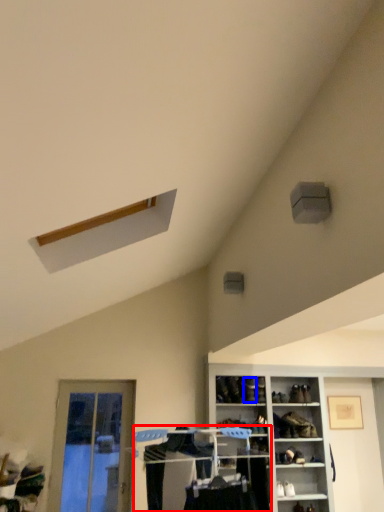
Question: Among these objects, which one is nearest to the camera, closet (highlighted by a red box) or shoe (highlighted by a blue box)?

Choices:
 (A) closet
 (B) shoe

Answer: (A)